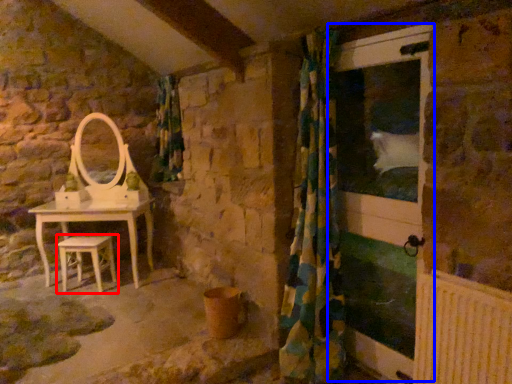
Question: Among these objects, which one is farthest to the camera, stool (highlighted by a red box) or screen door (highlighted by a blue box)?

Choices:
 (A) stool
 (B) screen door

Answer: (A)